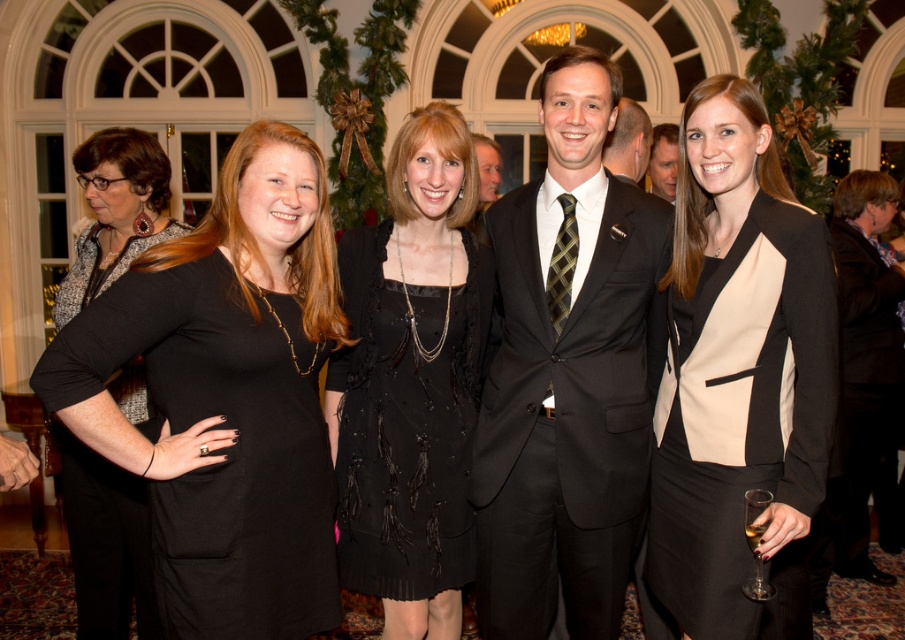
Question: Which is farther from the black matte blazer at center?

Choices:
 (A) black dress at center
 (B) matte black suit at center

Answer: (B)

Question: Which of the following is the farthest from the observer?

Choices:
 (A) (386, 548)
 (B) (642, 196)
 (C) (608, 141)

Answer: (C)

Question: Can you confirm if black leather jacket at center is positioned to the right of black silk suit at center?

Choices:
 (A) yes
 (B) no

Answer: (A)

Question: Does black leather jacket at center appear on the left side of brown textured tie at center?

Choices:
 (A) yes
 (B) no

Answer: (B)

Question: Which point appears farthest from the camera in this image?

Choices:
 (A) (129, 172)
 (B) (660, 189)

Answer: (B)

Question: Does matte black dress at left appear on the right side of brown textured tie at center?

Choices:
 (A) yes
 (B) no

Answer: (B)